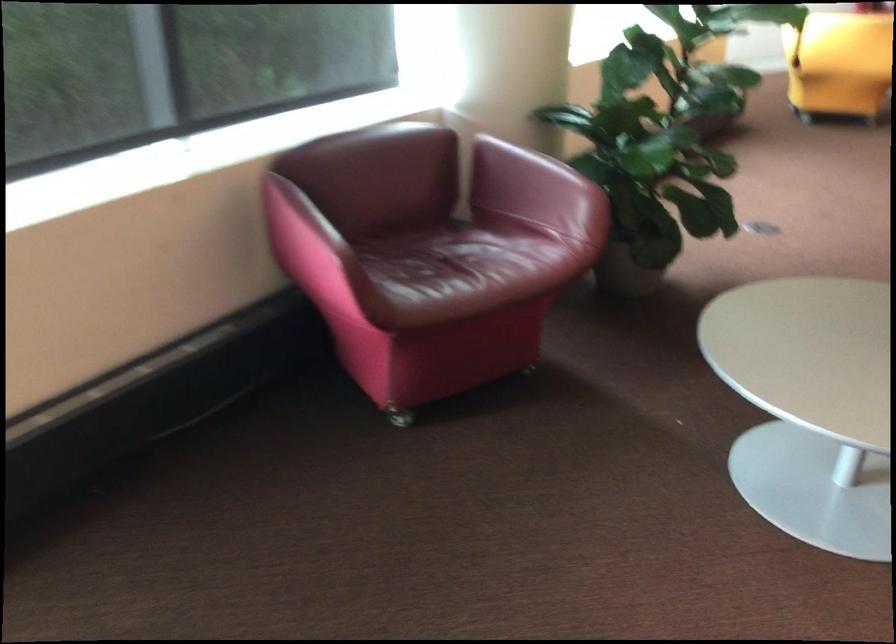
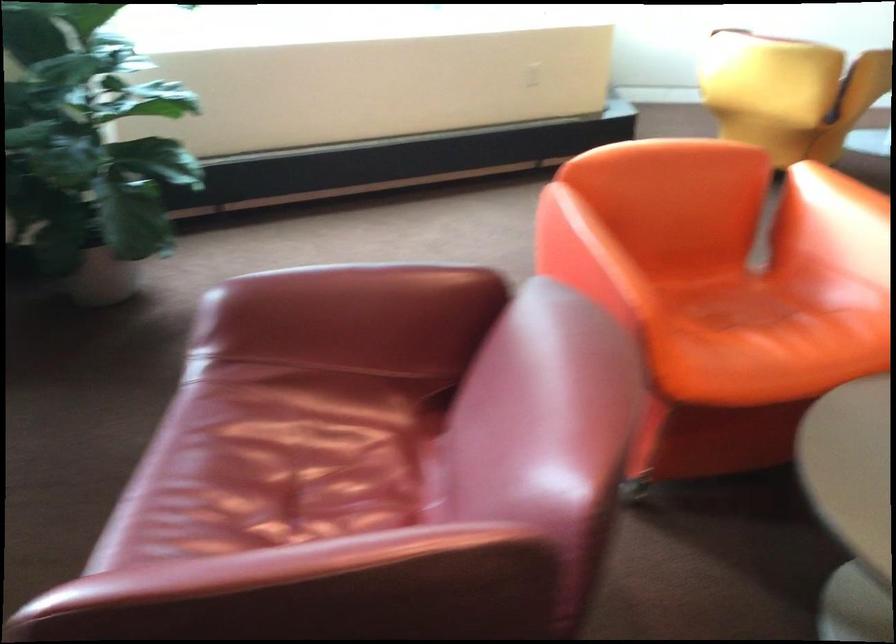
Question: Which direction would the cameraman need to move to produce the second image? Reply with the corresponding letter.

Choices:
 (A) Left
 (B) Right
 (C) Forward
 (D) Backward

Answer: (B)